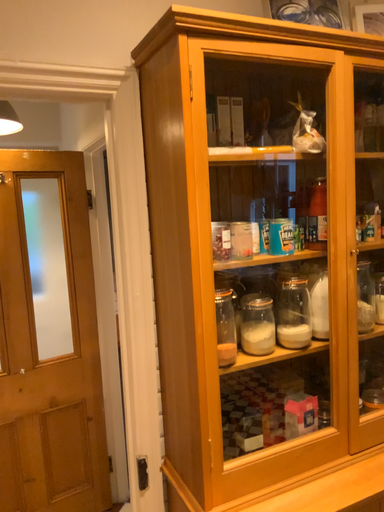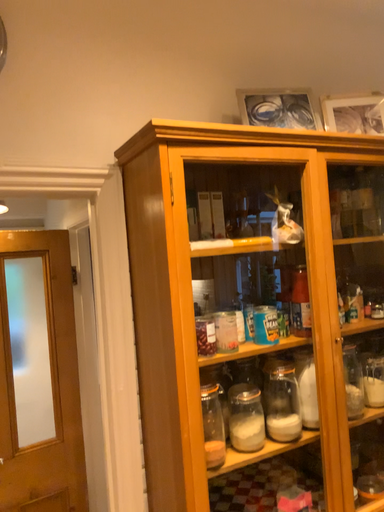
Question: How did the camera likely rotate when shooting the video?

Choices:
 (A) rotated downward
 (B) rotated upward

Answer: (B)